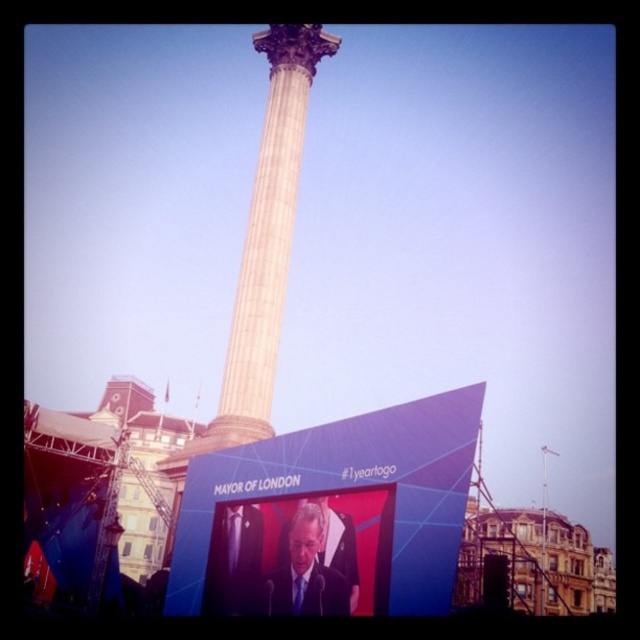
Where is `white marble column at center`? This screenshot has width=640, height=640. white marble column at center is located at coordinates (268, 234).

Does white marble column at center have a greater height compared to dark suit at center?

Yes, white marble column at center is taller than dark suit at center.

Between point (278, 193) and point (320, 500), which one is positioned in front?

Positioned in front is point (320, 500).

Where is `white marble column at center`? Image resolution: width=640 pixels, height=640 pixels. white marble column at center is located at coordinates (268, 234).